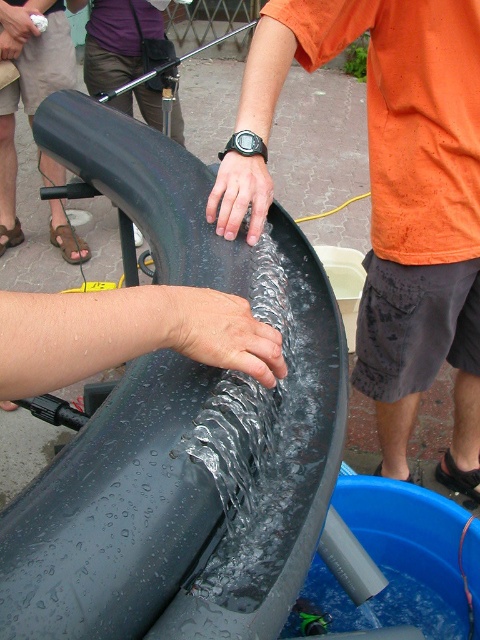
Who is taller, orange fabric shirt at center or wet skin at center?

orange fabric shirt at center

Which is more to the right, orange fabric shirt at center or wet skin at center?

Positioned to the right is orange fabric shirt at center.

The height and width of the screenshot is (640, 480). Identify the location of orange fabric shirt at center. (400, 196).

At what (x,y) coordinates should I click in order to perform the action: click on orange fabric shirt at center. Please return your answer as a coordinate pair (x, y). Looking at the image, I should click on (400, 196).

Is orange fabric shirt at center taller than matte black hand at center?

Correct, orange fabric shirt at center is much taller as matte black hand at center.

Is point (448, 22) in front of point (229, 227)?

No, (448, 22) is behind (229, 227).

What are the coordinates of `orange fabric shirt at center` in the screenshot? It's located at (400, 196).

Does point (48, 316) come closer to viewer compared to point (260, 193)?

Yes, it is in front of point (260, 193).

Between wet skin at center and matte black hand at center, which one is positioned higher?

matte black hand at center is above.

Is point (237, 360) behind point (228, 200)?

No.

Identify the location of wet skin at center. Image resolution: width=480 pixels, height=640 pixels. pyautogui.click(x=127, y=333).